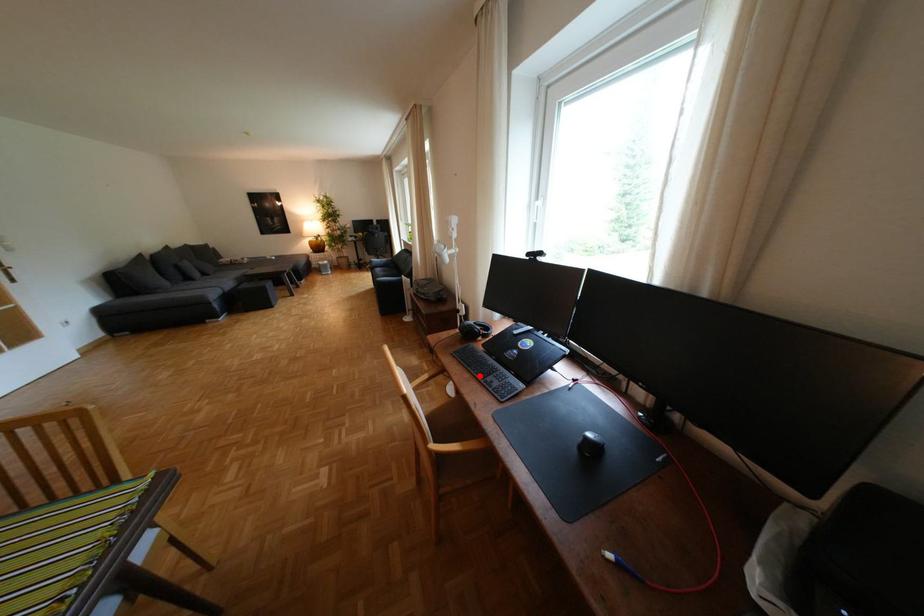
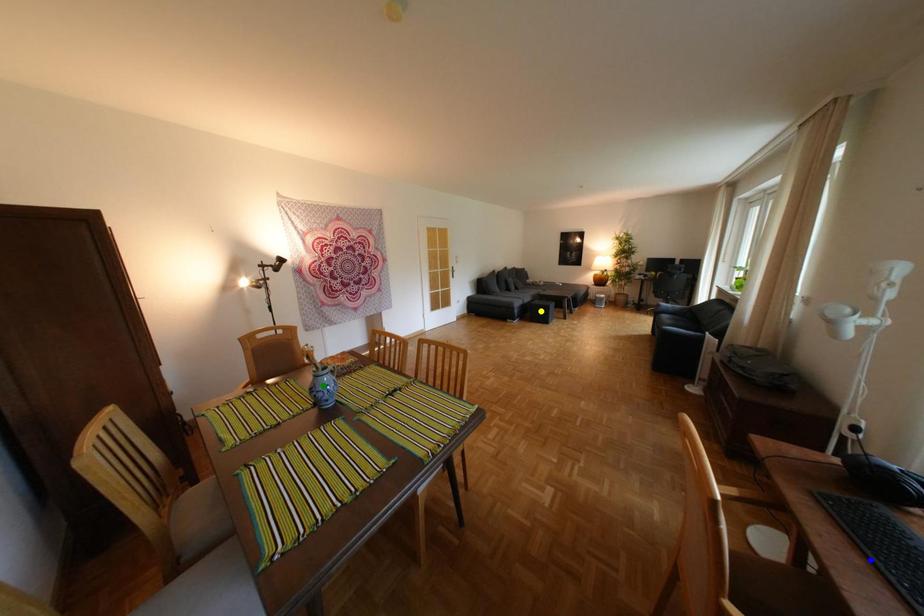
Question: I am providing you with two images of the same scene from different viewpoints. A red point is marked on the first image. You are given multiple points on the second image. In image 2, which mark is for the same physical point as the one in image 1?

Choices:
 (A) yellow point
 (B) blue point
 (C) green point

Answer: (B)